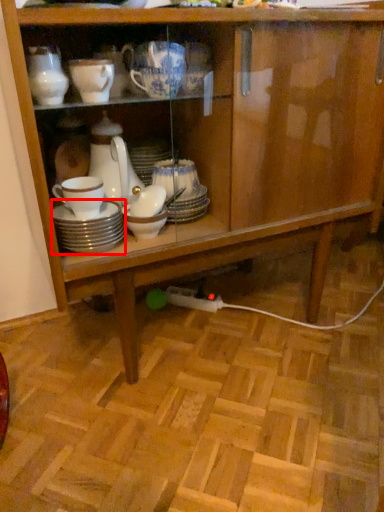
Question: Considering the relative positions of tableware (annotated by the red box) and tableware in the image provided, where is tableware (annotated by the red box) located with respect to the staircase?

Choices:
 (A) right
 (B) left

Answer: (B)